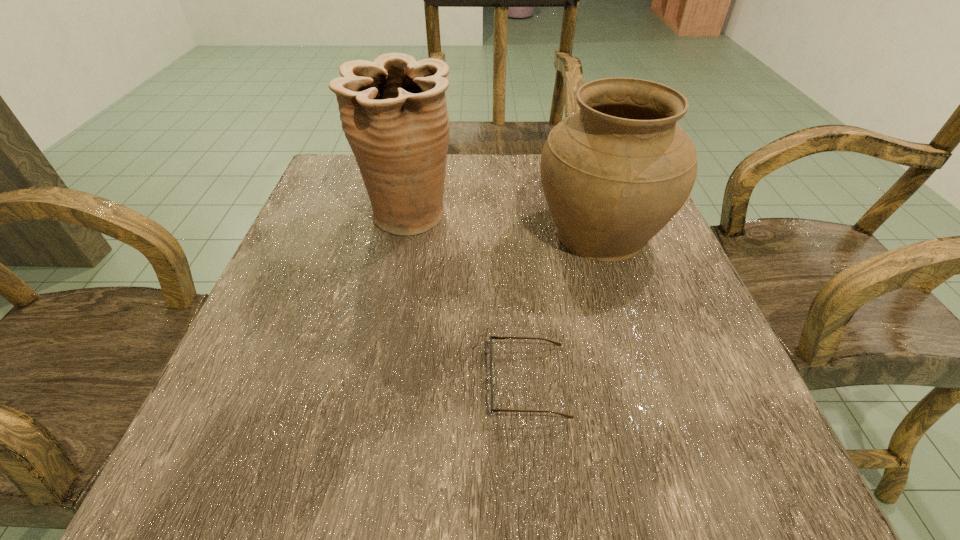
Identify the location of the left urn. The width and height of the screenshot is (960, 540). pos(393,111).

At what (x,y) coordinates should I click in order to perform the action: click on the right urn. Please return your answer as a coordinate pair (x, y). Looking at the image, I should click on (614, 173).

Locate an element on the screen. the nearest object is located at coordinates (492, 380).

Where is `the shortest object`? This screenshot has height=540, width=960. the shortest object is located at coordinates (492, 380).

In order to click on vacant space located 0.170m on the right of the left urn in this screenshot , I will do `click(537, 216)`.

Locate an element on the screen. The height and width of the screenshot is (540, 960). free space located 0.110m on the left of the right urn is located at coordinates (480, 233).

Where is `free location located on the front-facing side of the nearest object`? free location located on the front-facing side of the nearest object is located at coordinates (333, 381).

Locate an element on the screen. This screenshot has width=960, height=540. vacant area situated 0.390m on the front-facing side of the nearest object is located at coordinates (224, 381).

Where is `vacant area situated 0.290m on the front-facing side of the nearest object`? vacant area situated 0.290m on the front-facing side of the nearest object is located at coordinates click(292, 381).

Where is `object that is at the left edge`? This screenshot has height=540, width=960. object that is at the left edge is located at coordinates (393, 111).